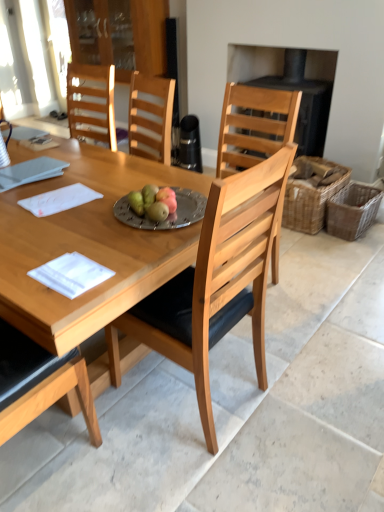
The height and width of the screenshot is (512, 384). Find the location of `vacant space that is in between light wood chair at center and wooden table at center`. vacant space that is in between light wood chair at center and wooden table at center is located at coordinates (170, 436).